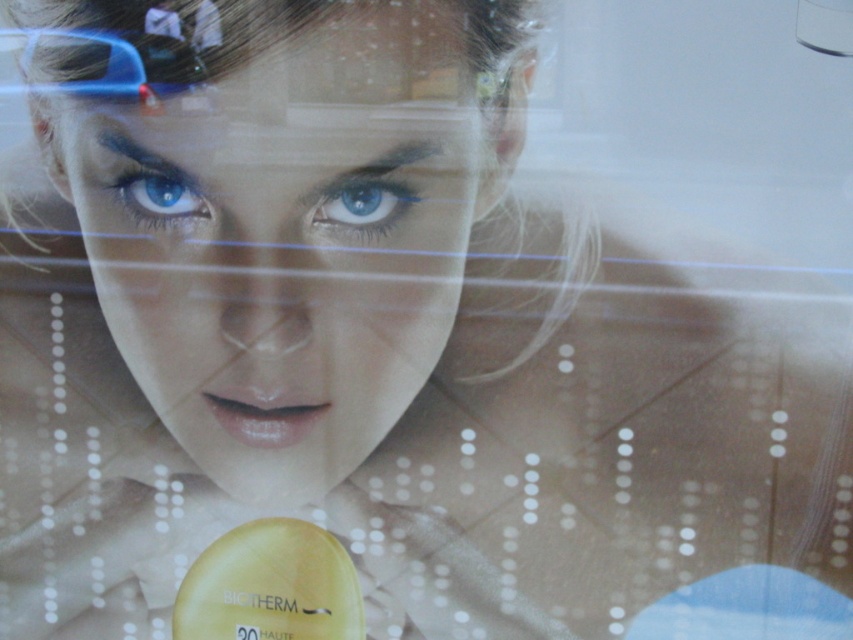
You are a makeup artist analyzing the image. You notice the smooth skin face at center and the blue matte eye at upper left. Which object is located to the right of the other?

The smooth skin face at center is positioned on the right side of blue matte eye at upper left.

You are a photographer trying to focus on the woman in the image. You notice a point at coordinates [361,205]. Where is this point located?

The point at coordinates [361,205] is located on the blue matte eye at center.